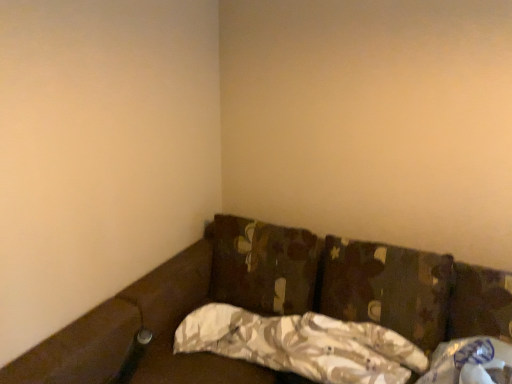
Question: Which direction should I rotate to look at camo fabric pillow at center, the first pillow in the right-to-left sequence?

Choices:
 (A) right
 (B) left

Answer: (A)

Question: Does camo fabric pillow at center, the 3th pillow positioned from the left, appear on the right side of camouflage fabric pillow at center, acting as the second pillow starting from the left?

Choices:
 (A) no
 (B) yes

Answer: (B)

Question: Would you say camo fabric pillow at center, the first pillow in the right-to-left sequence, is a long distance from camouflage fabric pillow at center, acting as the second pillow starting from the left?

Choices:
 (A) yes
 (B) no

Answer: (B)

Question: Is camo fabric pillow at center, the first pillow in the right-to-left sequence, located outside camouflage fabric pillow at center, acting as the second pillow starting from the left?

Choices:
 (A) no
 (B) yes

Answer: (B)

Question: Is camo fabric pillow at center, the first pillow in the right-to-left sequence, positioned in front of camouflage fabric pillow at center, which is the second pillow in right-to-left order?

Choices:
 (A) no
 (B) yes

Answer: (A)

Question: Does camo fabric pillow at center, the first pillow in the right-to-left sequence, have a greater height compared to camouflage fabric pillow at center, which is the second pillow in right-to-left order?

Choices:
 (A) yes
 (B) no

Answer: (A)

Question: From the image's perspective, is camo fabric pillow at center, the 3th pillow positioned from the left, beneath camouflage fabric pillow at center, acting as the second pillow starting from the left?

Choices:
 (A) no
 (B) yes

Answer: (A)

Question: Can you confirm if camouflage fabric pillow at center, acting as the third pillow starting from the right, is thinner than camo fabric pillow at center, the 3th pillow positioned from the left?

Choices:
 (A) no
 (B) yes

Answer: (B)

Question: From a real-world perspective, is camouflage fabric pillow at center, acting as the 1th pillow starting from the left, over camo fabric pillow at center, the first pillow in the right-to-left sequence?

Choices:
 (A) yes
 (B) no

Answer: (A)

Question: Does camouflage fabric pillow at center, acting as the 1th pillow starting from the left, have a larger size compared to camo fabric pillow at center, the 3th pillow positioned from the left?

Choices:
 (A) no
 (B) yes

Answer: (B)

Question: Is camouflage fabric pillow at center, acting as the 1th pillow starting from the left, directly adjacent to camo fabric pillow at center, the first pillow in the right-to-left sequence?

Choices:
 (A) no
 (B) yes

Answer: (A)

Question: Considering the relative sizes of camouflage fabric pillow at center, acting as the 1th pillow starting from the left, and camo fabric pillow at center, the first pillow in the right-to-left sequence, in the image provided, is camouflage fabric pillow at center, acting as the 1th pillow starting from the left, taller than camo fabric pillow at center, the first pillow in the right-to-left sequence,?

Choices:
 (A) no
 (B) yes

Answer: (B)

Question: Is camouflage fabric pillow at center, acting as the 1th pillow starting from the left, behind camo fabric pillow at center, the first pillow in the right-to-left sequence?

Choices:
 (A) yes
 (B) no

Answer: (A)

Question: Is camo fabric pillow at center, the first pillow in the right-to-left sequence, at the back of camouflage fabric pillow at center, which is the second pillow in right-to-left order?

Choices:
 (A) no
 (B) yes

Answer: (B)